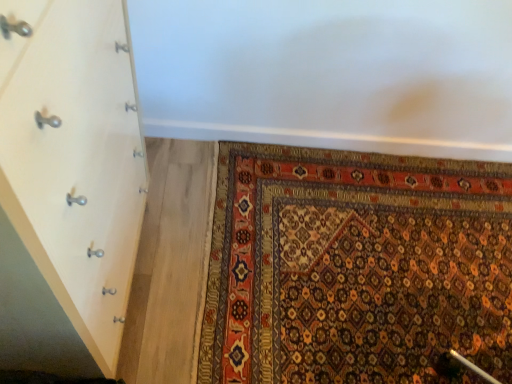
Question: Considering the positions of carpet with intricate patterns at lower right and white wood chest of drawers at left in the image, is carpet with intricate patterns at lower right wider or thinner than white wood chest of drawers at left?

Choices:
 (A) wide
 (B) thin

Answer: (A)

Question: From a real-world perspective, is carpet with intricate patterns at lower right physically located above or below white wood chest of drawers at left?

Choices:
 (A) below
 (B) above

Answer: (A)

Question: From the image's perspective, is carpet with intricate patterns at lower right above or below white wood chest of drawers at left?

Choices:
 (A) below
 (B) above

Answer: (A)

Question: From the image's perspective, is white wood chest of drawers at left located above or below carpet with intricate patterns at lower right?

Choices:
 (A) below
 (B) above

Answer: (B)

Question: Based on their positions, is white wood chest of drawers at left located to the left or right of carpet with intricate patterns at lower right?

Choices:
 (A) left
 (B) right

Answer: (A)

Question: Would you say white wood chest of drawers at left is inside or outside carpet with intricate patterns at lower right?

Choices:
 (A) inside
 (B) outside

Answer: (B)

Question: Looking at their shapes, would you say white wood chest of drawers at left is wider or thinner than carpet with intricate patterns at lower right?

Choices:
 (A) wide
 (B) thin

Answer: (B)